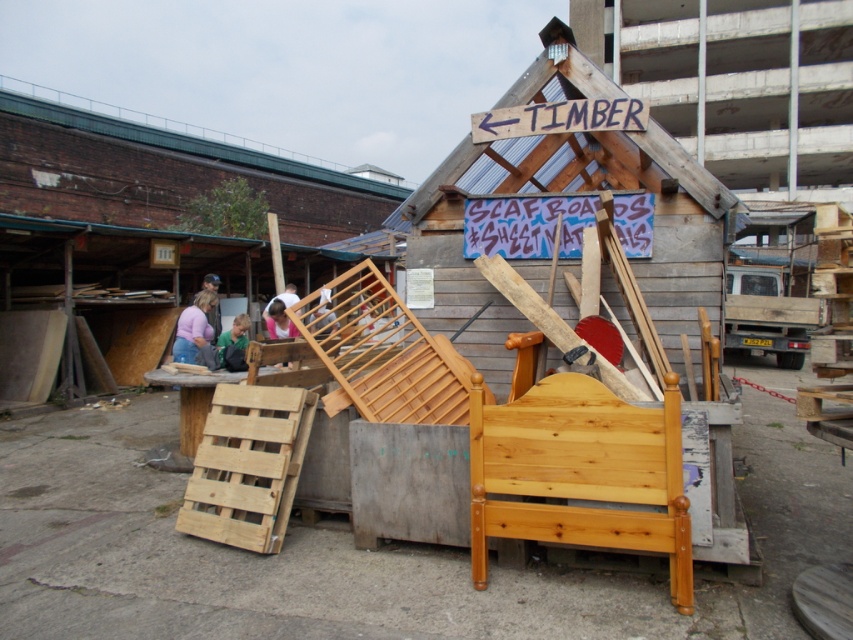
Question: Which object is the farthest from the wooden pallets at center?

Choices:
 (A) light brown wooden chair at center
 (B) light brown leather jacket at center
 (C) light purple fabric at center

Answer: (B)

Question: Is wooden pallets at center wider than pink fabric shirt at center?

Choices:
 (A) no
 (B) yes

Answer: (B)

Question: Where is wooden pallets at center located in relation to pink fabric shirt at center in the image?

Choices:
 (A) left
 (B) right

Answer: (A)

Question: Which object is the farthest from the wooden pallets at center?

Choices:
 (A) pink fabric shirt at center
 (B) light brown wooden chair at center
 (C) light brown leather jacket at center

Answer: (C)

Question: Among these points, which one is farthest from the camera?

Choices:
 (A) (183, 310)
 (B) (44, 212)
 (C) (213, 273)
 (D) (234, 369)

Answer: (B)

Question: Is light purple fabric at center thinner than light brown leather jacket at center?

Choices:
 (A) yes
 (B) no

Answer: (B)